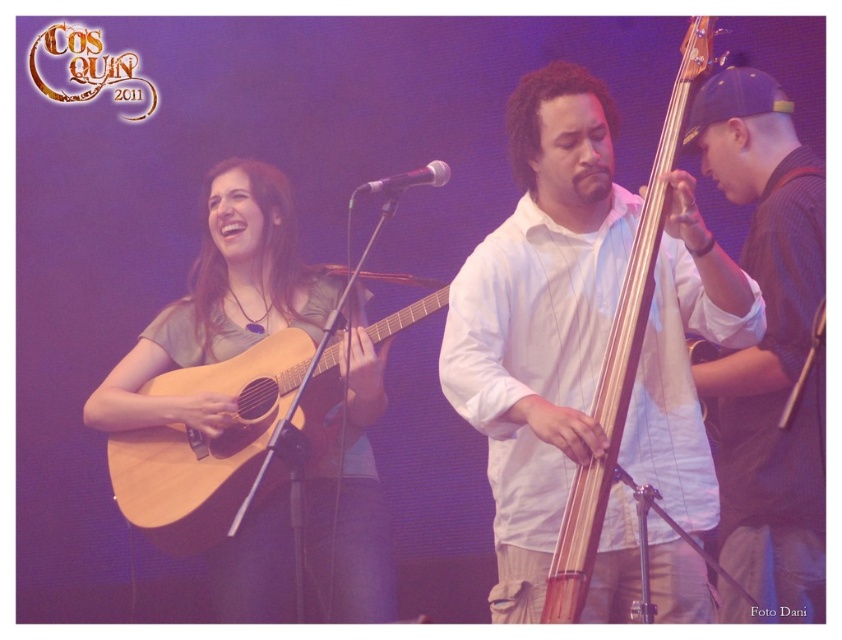
Is natural wood acoustic guitar at left taller than metallic silver microphone at center?

Yes, natural wood acoustic guitar at left is taller than metallic silver microphone at center.

Which is more to the right, natural wood acoustic guitar at left or metallic silver microphone at center?

From the viewer's perspective, metallic silver microphone at center appears more on the right side.

Looking at this image, who is more distant from viewer, (248, 387) or (401, 180)?

Point (248, 387)

What are the coordinates of `natural wood acoustic guitar at left` in the screenshot? It's located at (206, 445).

Who is higher up, natural wood acoustic guitar at center or metallic silver microphone at center?

metallic silver microphone at center is higher up.

Is natural wood acoustic guitar at center positioned behind metallic silver microphone at center?

No, it is not.

Identify the location of natural wood acoustic guitar at center. (627, 376).

Who is taller, natural wood acoustic guitar at left or natural wood acoustic guitar at center?

With more height is natural wood acoustic guitar at center.

Between point (235, 502) and point (670, 140), which one is positioned behind?

The point (235, 502) is more distant.

This screenshot has width=842, height=640. I want to click on natural wood acoustic guitar at left, so tap(206, 445).